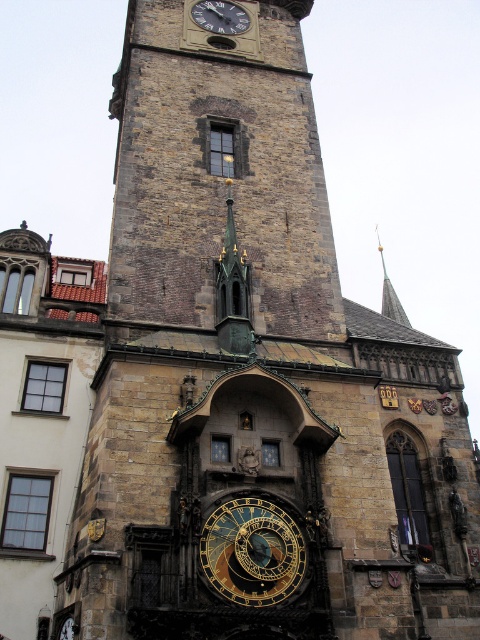
Question: Which point is closer to the camera?

Choices:
 (A) (392, 298)
 (B) (207, 538)

Answer: (B)

Question: Is gold metallic clock at upper center closer to camera compared to gold/brass spire at upper right?

Choices:
 (A) yes
 (B) no

Answer: (B)

Question: Which of the following is the farthest from the observer?

Choices:
 (A) (240, 595)
 (B) (382, 252)
 (C) (240, 19)

Answer: (B)

Question: Can you confirm if gold metallic clock at center is positioned below gold/brass spire at upper right?

Choices:
 (A) no
 (B) yes

Answer: (B)

Question: Does gold metallic clock at center lie in front of gold/brass spire at upper right?

Choices:
 (A) yes
 (B) no

Answer: (A)

Question: Which point is farther to the camera?

Choices:
 (A) gold/brass spire at upper right
 (B) gold metallic clock at upper center
 (C) gold metallic clock at center

Answer: (B)